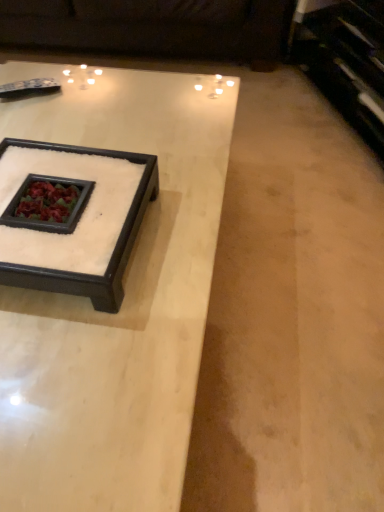
Question: From the image's perspective, is white marble tray at center, the first coffee table when ordered from back to front, on white marble coffee table at center, which ranks as the first coffee table in front-to-back order?

Choices:
 (A) no
 (B) yes

Answer: (B)

Question: From the image's perspective, is white marble tray at center, acting as the second coffee table starting from the front, under white marble coffee table at center, which ranks as the first coffee table in front-to-back order?

Choices:
 (A) no
 (B) yes

Answer: (A)

Question: Considering the relative sizes of white marble tray at center, the first coffee table when ordered from back to front, and white marble coffee table at center, which ranks as the first coffee table in front-to-back order, in the image provided, is white marble tray at center, the first coffee table when ordered from back to front, wider than white marble coffee table at center, which ranks as the first coffee table in front-to-back order,?

Choices:
 (A) no
 (B) yes

Answer: (A)

Question: Does white marble tray at center, acting as the second coffee table starting from the front, have a greater height compared to white marble coffee table at center, which ranks as the first coffee table in front-to-back order?

Choices:
 (A) no
 (B) yes

Answer: (A)

Question: Does white marble tray at center, acting as the second coffee table starting from the front, contain white marble coffee table at center, the second coffee table from the back?

Choices:
 (A) yes
 (B) no

Answer: (B)

Question: Based on their positions, is white marble coffee table at center, which ranks as the first coffee table in front-to-back order, located to the left or right of dark brown leather couch at upper center?

Choices:
 (A) right
 (B) left

Answer: (A)

Question: Relative to dark brown leather couch at upper center, is white marble coffee table at center, the second coffee table from the back, in front or behind?

Choices:
 (A) behind
 (B) front

Answer: (B)

Question: Considering the positions of white marble coffee table at center, the second coffee table from the back, and dark brown leather couch at upper center in the image, is white marble coffee table at center, the second coffee table from the back, taller or shorter than dark brown leather couch at upper center?

Choices:
 (A) short
 (B) tall

Answer: (B)

Question: From the image's perspective, relative to dark brown leather couch at upper center, is white marble coffee table at center, which ranks as the first coffee table in front-to-back order, above or below?

Choices:
 (A) below
 (B) above

Answer: (A)

Question: Is white marble coffee table at center, the second coffee table from the back, taller or shorter than white marble tray at center, the first coffee table when ordered from back to front?

Choices:
 (A) tall
 (B) short

Answer: (A)

Question: From a real-world perspective, is white marble coffee table at center, which ranks as the first coffee table in front-to-back order, above or below white marble tray at center, acting as the second coffee table starting from the front?

Choices:
 (A) above
 (B) below

Answer: (B)

Question: Considering the positions of white marble coffee table at center, which ranks as the first coffee table in front-to-back order, and white marble tray at center, acting as the second coffee table starting from the front, in the image, is white marble coffee table at center, which ranks as the first coffee table in front-to-back order, wider or thinner than white marble tray at center, acting as the second coffee table starting from the front,?

Choices:
 (A) thin
 (B) wide

Answer: (B)

Question: Does point (145, 80) appear closer or farther from the camera than point (140, 220)?

Choices:
 (A) farther
 (B) closer

Answer: (A)

Question: Considering the positions of point (163, 36) and point (137, 83), is point (163, 36) closer or farther from the camera than point (137, 83)?

Choices:
 (A) closer
 (B) farther

Answer: (B)

Question: From a real-world perspective, is dark brown leather couch at upper center physically located above or below white marble coffee table at center, the second coffee table from the back?

Choices:
 (A) above
 (B) below

Answer: (B)